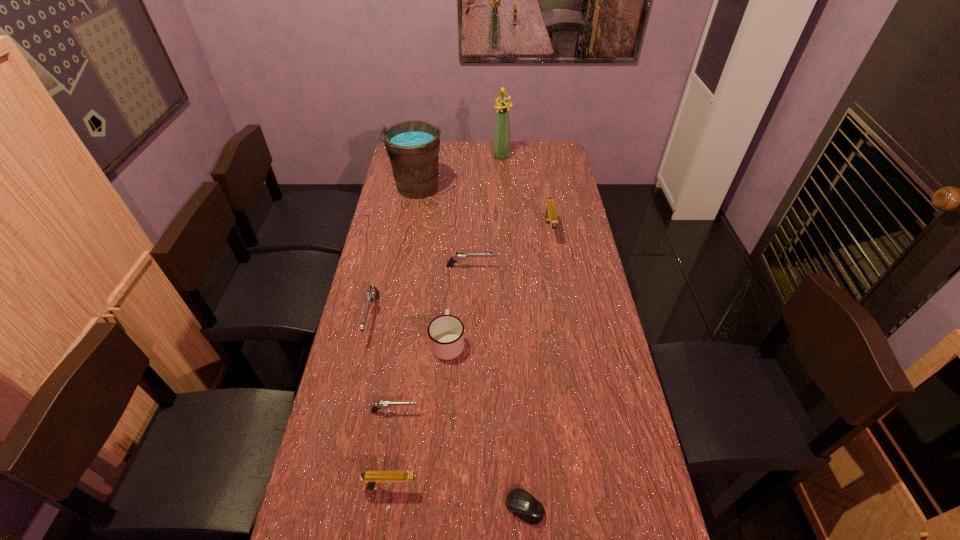
The height and width of the screenshot is (540, 960). I want to click on the nearer tan pistol, so click(x=371, y=479).

Find the location of a particular element. the rightmost silver pistol is located at coordinates (459, 256).

Find the location of a particular element. Image resolution: width=960 pixels, height=540 pixels. the farthest silver pistol is located at coordinates (459, 256).

Identify the location of the smallest silver pistol. Image resolution: width=960 pixels, height=540 pixels. (386, 404).

In order to click on the seventh farthest object in this screenshot , I will do `click(386, 404)`.

In order to click on black mouse in this screenshot , I will do `click(519, 502)`.

Where is `the shortest object`? the shortest object is located at coordinates (519, 502).

Where is `free space located on the front-facing side of the farthest object`? The width and height of the screenshot is (960, 540). free space located on the front-facing side of the farthest object is located at coordinates (502, 177).

The height and width of the screenshot is (540, 960). Identify the location of vacant region located with a handle on the side of the wine bucket. (406, 256).

At what (x,y) coordinates should I click in order to perform the action: click on vacant space located 0.250m at the barrel of the bigger tan pistol. Please return your answer as a coordinate pair (x, y). This screenshot has height=540, width=960. Looking at the image, I should click on (560, 293).